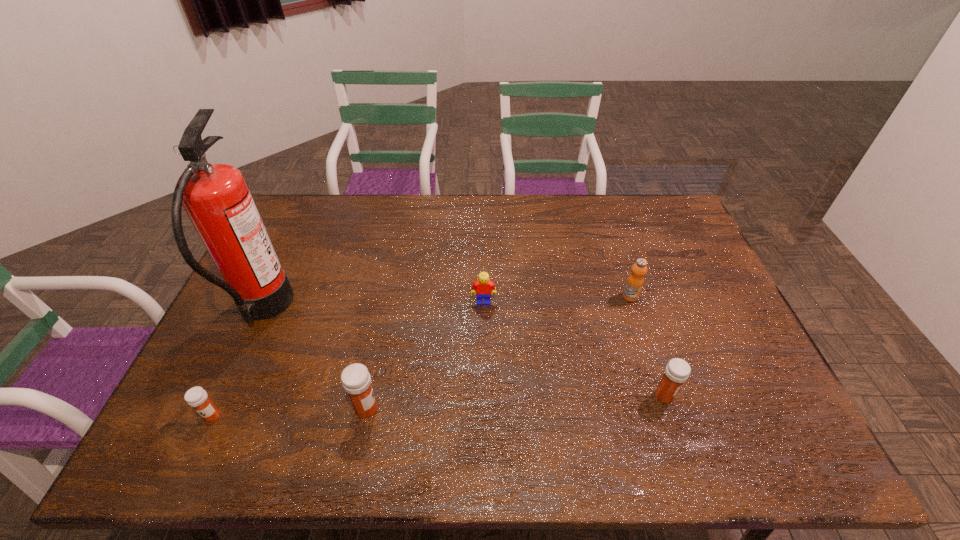
Where is `vacant area located on the front label of the orange juice`? The width and height of the screenshot is (960, 540). vacant area located on the front label of the orange juice is located at coordinates (669, 415).

Image resolution: width=960 pixels, height=540 pixels. Identify the location of vacant region located on the front-facing side of the fire extinguisher. (330, 310).

I want to click on free space located 0.200m on the front-facing side of the third object from right to left, so click(484, 363).

Image resolution: width=960 pixels, height=540 pixels. I want to click on medicine at the left edge, so click(196, 397).

Where is `fire extinguisher that is at the left edge`? fire extinguisher that is at the left edge is located at coordinates click(x=216, y=198).

Locate an element on the screen. object that is at the near left corner is located at coordinates (196, 397).

Identify the location of free region at the far edge of the desktop. (386, 205).

In the image, there is a desktop. Where is `free space at the near edge`? The image size is (960, 540). free space at the near edge is located at coordinates (663, 402).

In the image, there is a desktop. Where is `free space at the left edge`? The width and height of the screenshot is (960, 540). free space at the left edge is located at coordinates (242, 348).

This screenshot has width=960, height=540. In the image, there is a desktop. What are the coordinates of `vacant region at the right edge` in the screenshot? It's located at (716, 302).